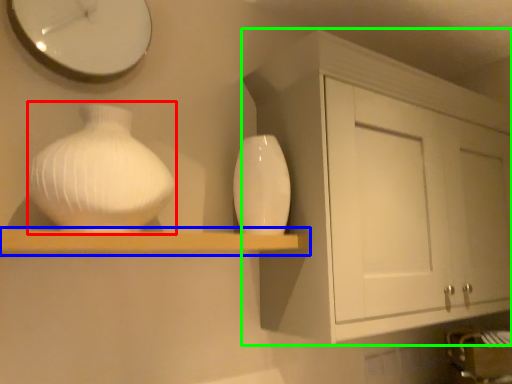
Question: Which object is positioned closest to vase (highlighted by a red box)? Select from shelf (highlighted by a blue box) and cabinetry (highlighted by a green box).

Choices:
 (A) shelf
 (B) cabinetry

Answer: (A)